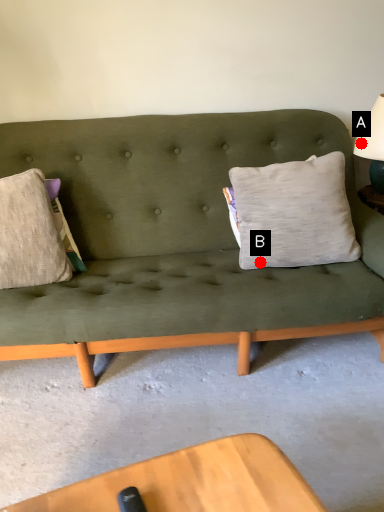
Question: Two points are circled on the image, labeled by A and B beside each circle. Among these points, which one is nearest to the camera?

Choices:
 (A) A is closer
 (B) B is closer

Answer: (B)